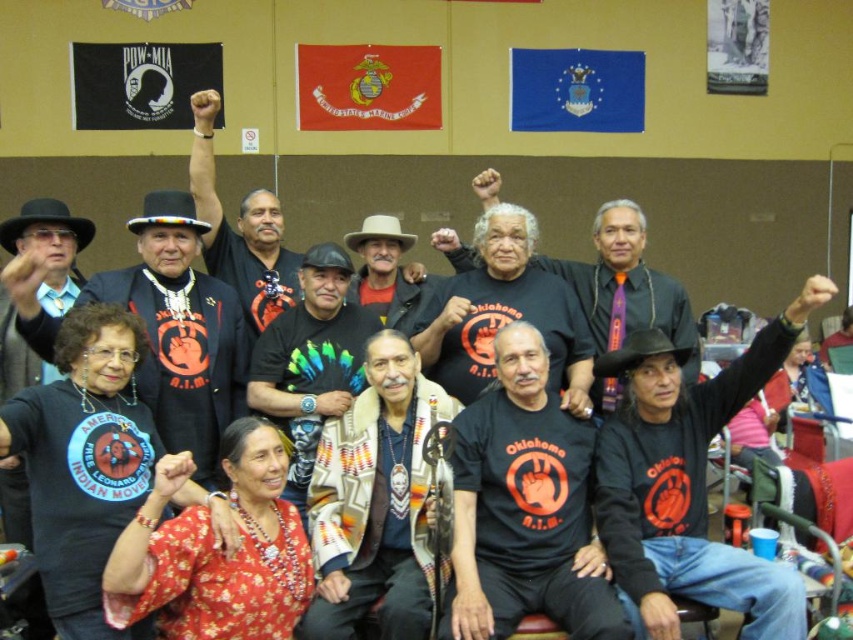
You are an attendee at this event and want to find the woven fabric shawl at center. Based on the coordinates provided, can you determine its position relative to the entrance of the hall?

The woven fabric shawl at center is located at point (376, 500), which places it near the center of the image. Since the entrance is typically located at the bottom of the image, the shawl is positioned towards the back of the hall relative to the entrance.

You are an anthropologist studying cultural attire in the image. You notice a point marked at coordinates [376,500]. What cultural item is located at that point?

The point at [376,500] indicates a woven fabric shawl at center.

You are an event photographer at the scene. You need to capture a photo where both the woven fabric shawl at center and the black cotton shirt at center are visible. Which object should you position to the left in your camera frame to ensure both are in the shot?

The woven fabric shawl at center is positioned on the left side of the black cotton shirt at center, so you should position the woven fabric shawl at center to the left in your camera frame to ensure both are visible.